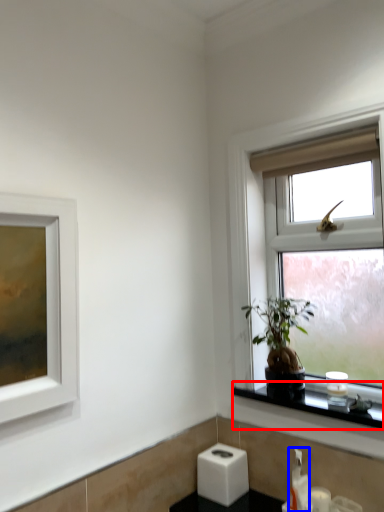
Question: Among these objects, which one is farthest to the camera, window sill (highlighted by a red box) or soap dispenser (highlighted by a blue box)?

Choices:
 (A) window sill
 (B) soap dispenser

Answer: (B)